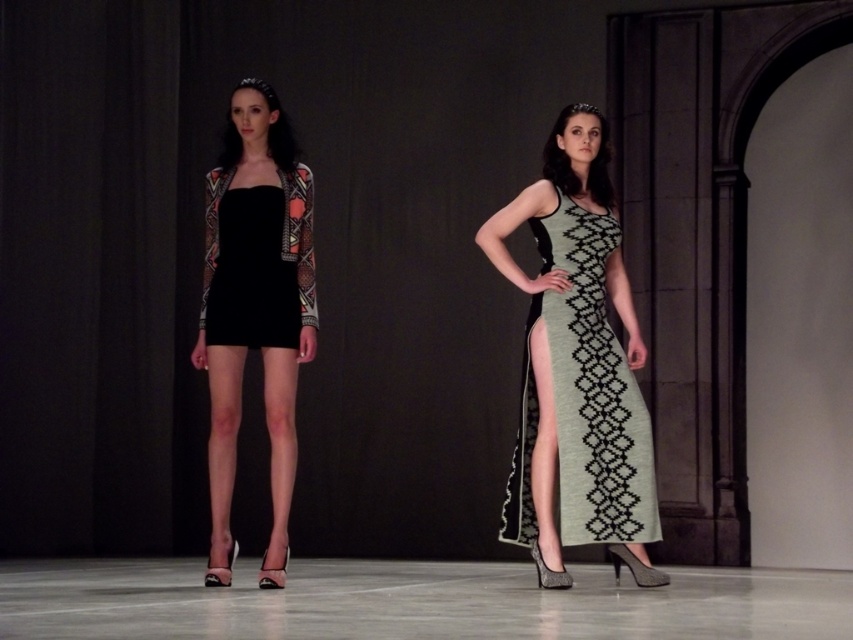
Which is in front, point (631, 387) or point (219, 189)?

Point (631, 387)

Does point (582, 300) come closer to viewer compared to point (315, 300)?

That is True.

Identify the location of green textured dress at center. The image size is (853, 640). (582, 397).

Can you confirm if matte black dress at center is smaller than green textured dress at center?

Actually, matte black dress at center might be larger than green textured dress at center.

Between matte black dress at center and green textured dress at center, which one appears on the left side from the viewer's perspective?

From the viewer's perspective, matte black dress at center appears more on the left side.

Locate an element on the screen. The height and width of the screenshot is (640, 853). matte black dress at center is located at coordinates (254, 308).

In the scene shown: Is matte black dress at center below black matte dress at center?

Yes.

Who is shorter, matte black dress at center or black matte dress at center?

black matte dress at center is shorter.

Which is in front, point (302, 330) or point (289, 250)?

Point (302, 330)

Find the location of a particular element. The image size is (853, 640). matte black dress at center is located at coordinates (254, 308).